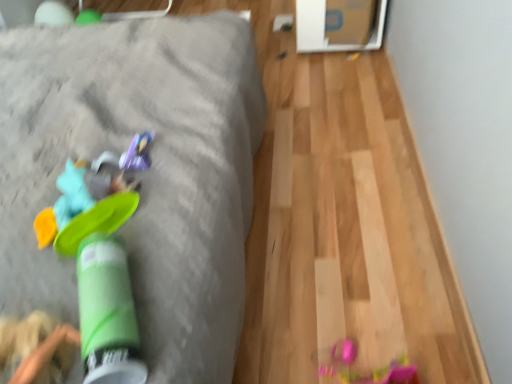
Question: Does rubberized green frisbee at left, which ranks as the first toy in front-to-back order, lie in front of green plastic cup at left?

Choices:
 (A) no
 (B) yes

Answer: (B)

Question: Does rubberized green frisbee at left, marked as the 2th toy in a back-to-front arrangement, have a larger size compared to green plastic cup at left?

Choices:
 (A) yes
 (B) no

Answer: (B)

Question: Is rubberized green frisbee at left, marked as the 2th toy in a back-to-front arrangement, at the right side of green plastic cup at left?

Choices:
 (A) no
 (B) yes

Answer: (A)

Question: Can you confirm if rubberized green frisbee at left, which ranks as the first toy in front-to-back order, is wider than green plastic cup at left?

Choices:
 (A) no
 (B) yes

Answer: (A)

Question: Does rubberized green frisbee at left, marked as the 2th toy in a back-to-front arrangement, appear on the left side of green plastic cup at left?

Choices:
 (A) yes
 (B) no

Answer: (A)

Question: Is rubberized green frisbee at left, marked as the 2th toy in a back-to-front arrangement, oriented away from green plastic cup at left?

Choices:
 (A) yes
 (B) no

Answer: (B)

Question: Can you confirm if green plastic cup at left is bigger than rubberized green frisbee at left, which ranks as the first toy in front-to-back order?

Choices:
 (A) yes
 (B) no

Answer: (A)

Question: Considering the relative sizes of green plastic cup at left and rubberized green frisbee at left, which ranks as the first toy in front-to-back order, in the image provided, is green plastic cup at left smaller than rubberized green frisbee at left, which ranks as the first toy in front-to-back order,?

Choices:
 (A) no
 (B) yes

Answer: (A)

Question: Could you tell me if green plastic cup at left is facing rubberized green frisbee at left, marked as the 2th toy in a back-to-front arrangement?

Choices:
 (A) yes
 (B) no

Answer: (B)

Question: From a real-world perspective, is green plastic cup at left physically above rubberized green frisbee at left, marked as the 2th toy in a back-to-front arrangement?

Choices:
 (A) yes
 (B) no

Answer: (B)

Question: Considering the relative positions of green plastic cup at left and rubberized green frisbee at left, which ranks as the first toy in front-to-back order, in the image provided, is green plastic cup at left to the right of rubberized green frisbee at left, which ranks as the first toy in front-to-back order, from the viewer's perspective?

Choices:
 (A) no
 (B) yes

Answer: (B)

Question: Is rubberized green frisbee at left, marked as the 2th toy in a back-to-front arrangement, located within green plastic cup at left?

Choices:
 (A) no
 (B) yes

Answer: (A)

Question: From the image's perspective, is green plastic cup at left located above shiny purple toy at center, the first toy viewed from the back?

Choices:
 (A) yes
 (B) no

Answer: (A)